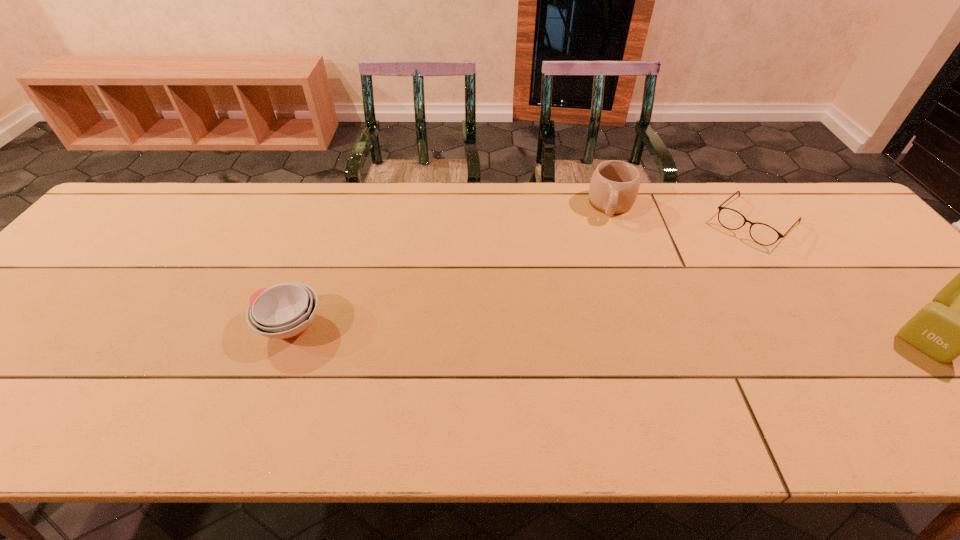
Where is `free spot on the desktop that is between the soup bowl and the dumbbell and is positioned on the side of the mug with the handle`? The image size is (960, 540). free spot on the desktop that is between the soup bowl and the dumbbell and is positioned on the side of the mug with the handle is located at coordinates (596, 326).

I want to click on free spot on the desktop that is between the soup bowl and the rightmost object and is positioned on the front-facing side of the third object from left to right, so click(x=652, y=326).